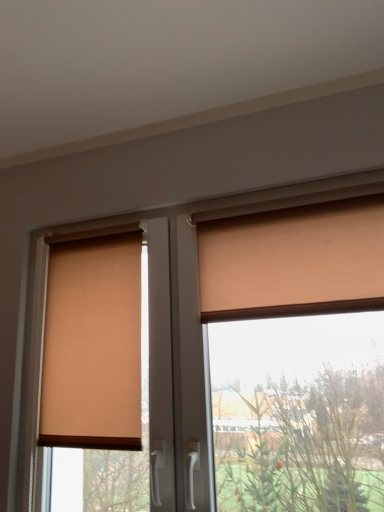
Question: Is point (352, 217) closer or farther from the camera than point (49, 344)?

Choices:
 (A) farther
 (B) closer

Answer: (B)

Question: From a real-world perspective, relative to matte beige blind at left, is matte orange curtain at upper right vertically above or below?

Choices:
 (A) above
 (B) below

Answer: (A)

Question: Estimate the real-world distances between objects in this image. Which object is closer to the matte orange curtain at upper right?

Choices:
 (A) matte beige blind at left
 (B) matte orange roller blind at center

Answer: (B)

Question: Which of these objects is positioned closest to the matte beige blind at left?

Choices:
 (A) matte orange roller blind at center
 (B) matte orange curtain at upper right

Answer: (A)